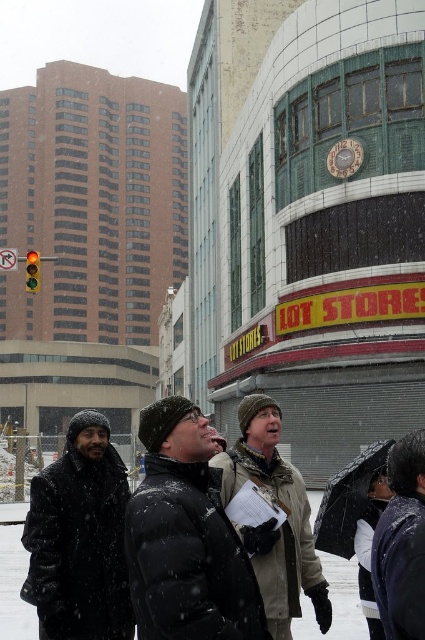
Question: Among these points, which one is farthest from the camera?

Choices:
 (A) (70, 632)
 (B) (384, 588)
 (C) (362, 492)

Answer: (C)

Question: Does black matte jacket at center have a smaller size compared to khaki wool jacket at center?

Choices:
 (A) yes
 (B) no

Answer: (A)

Question: Which point is farther to the camera?

Choices:
 (A) transparent plastic umbrella at lower right
 (B) khaki wool jacket at center
 (C) black matte jacket at center

Answer: (A)

Question: Which point is closer to the camera taking this photo?

Choices:
 (A) (234, 614)
 (B) (269, 408)

Answer: (A)

Question: Does dark gray woolen hat at lower left appear on the right side of transparent plastic umbrella at lower right?

Choices:
 (A) no
 (B) yes

Answer: (A)

Question: In this image, where is dark gray woolen hat at lower left located relative to shiny black jacket at lower right?

Choices:
 (A) below
 (B) above

Answer: (A)